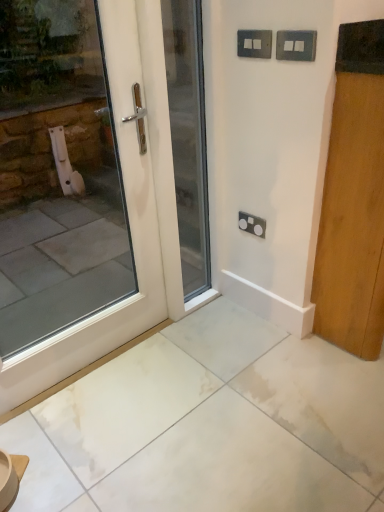
This screenshot has width=384, height=512. What do you see at coordinates (128, 216) in the screenshot? I see `white glossy door at left, which is counted as the first door, starting from the left` at bounding box center [128, 216].

What is the approximate width of satin black socket at center, positioned as the 3th electric outlet in top-to-bottom order?

It is 0.78 inches.

The image size is (384, 512). Describe the element at coordinates (296, 45) in the screenshot. I see `metallic gray switch at upper right, which is counted as the second electric outlet, starting from the bottom` at that location.

What is the approximate width of white glossy door at center, acting as the second door starting from the left?

white glossy door at center, acting as the second door starting from the left, is 3.87 inches in width.

Measure the distance between white glossy door at center, which is the 2th door from right to left, and camera.

white glossy door at center, which is the 2th door from right to left, and camera are 4.50 feet apart.

Where is `wooden door at right, the 3th door viewed from the left`? wooden door at right, the 3th door viewed from the left is located at coordinates (353, 220).

Are metallic silver switch at upper center, which ranks as the 3th electric outlet in bottom-to-top order, and satin black socket at center, arranged as the first electric outlet when ordered from the bottom, beside each other?

metallic silver switch at upper center, which ranks as the 3th electric outlet in bottom-to-top order, is not next to satin black socket at center, arranged as the first electric outlet when ordered from the bottom, and they're not touching.

Which object is wider, metallic silver switch at upper center, which ranks as the 3th electric outlet in bottom-to-top order, or satin black socket at center, acting as the first electric outlet starting from the back?

Wider between the two is metallic silver switch at upper center, which ranks as the 3th electric outlet in bottom-to-top order.

Which point is more forward, (245,44) or (238,219)?

The point (245,44) is closer.

How much distance is there between metallic silver switch at upper center, the second electric outlet viewed from the front, and satin black socket at center, arranged as the first electric outlet when ordered from the bottom?

metallic silver switch at upper center, the second electric outlet viewed from the front, is 64.26 centimeters from satin black socket at center, arranged as the first electric outlet when ordered from the bottom.

How different are the orientations of wooden door at right, the 3th door viewed from the left, and white glossy door at center, acting as the second door starting from the left, in degrees?

wooden door at right, the 3th door viewed from the left, and white glossy door at center, acting as the second door starting from the left, are facing 1.06 degrees away from each other.

Which of these two, wooden door at right, positioned as the 1th door in right-to-left order, or white glossy door at center, which is the 2th door from right to left, is bigger?

With larger size is wooden door at right, positioned as the 1th door in right-to-left order.

Is white glossy door at center, which is the 2th door from right to left, completely or partially inside wooden door at right, positioned as the 1th door in right-to-left order?

No, white glossy door at center, which is the 2th door from right to left, is located outside of wooden door at right, positioned as the 1th door in right-to-left order.

Looking at this image, is wooden door at right, the 3th door viewed from the left, closer to camera compared to white glossy door at center, acting as the second door starting from the left?

That is True.

Does white glossy door at center, which is the 2th door from right to left, appear on the right side of white glossy door at left, acting as the third door starting from the right?

Indeed, white glossy door at center, which is the 2th door from right to left, is positioned on the right side of white glossy door at left, acting as the third door starting from the right.

Is white glossy door at center, acting as the second door starting from the left, next to white glossy door at left, acting as the third door starting from the right, and touching it?

There is a gap between white glossy door at center, acting as the second door starting from the left, and white glossy door at left, acting as the third door starting from the right.

Do you think white glossy door at center, acting as the second door starting from the left, is within white glossy door at left, acting as the third door starting from the right, or outside of it?

white glossy door at center, acting as the second door starting from the left, is outside white glossy door at left, acting as the third door starting from the right.

Which object is closer to the camera, white glossy door at center, acting as the second door starting from the left, or white glossy door at left, acting as the third door starting from the right?

white glossy door at left, acting as the third door starting from the right, is closer to the camera.

Is the depth of white glossy door at left, acting as the third door starting from the right, greater than that of white glossy door at center, acting as the second door starting from the left?

No, white glossy door at left, acting as the third door starting from the right, is closer to the camera.

Which is correct: white glossy door at left, acting as the third door starting from the right, is inside white glossy door at center, which is the 2th door from right to left, or outside of it?

The correct answer is: outside.

Is white glossy door at left, acting as the third door starting from the right, facing towards white glossy door at center, which is the 2th door from right to left?

No, white glossy door at left, acting as the third door starting from the right, is not turned towards white glossy door at center, which is the 2th door from right to left.

Is white glossy door at left, acting as the third door starting from the right, far away from white glossy door at center, acting as the second door starting from the left?

white glossy door at left, acting as the third door starting from the right, is near white glossy door at center, acting as the second door starting from the left, not far away.

Identify the location of electric outlet that is the 1st one above the satin black socket at center, acting as the first electric outlet starting from the back (from a real-world perspective). (296, 45).

Looking at the image, does metallic gray switch at upper right, which is counted as the 2th electric outlet, starting from the top, seem bigger or smaller compared to satin black socket at center, acting as the first electric outlet starting from the back?

metallic gray switch at upper right, which is counted as the 2th electric outlet, starting from the top, is bigger than satin black socket at center, acting as the first electric outlet starting from the back.

Can you tell me how much metallic gray switch at upper right, the 3th electric outlet from the back, and satin black socket at center, acting as the first electric outlet starting from the back, differ in facing direction?

The angular difference between metallic gray switch at upper right, the 3th electric outlet from the back, and satin black socket at center, acting as the first electric outlet starting from the back, is 0.0235 degrees.

From the picture: Does metallic gray switch at upper right, the 3th electric outlet from the back, have a lesser height compared to satin black socket at center, which ranks as the third electric outlet in front-to-back order?

Correct, metallic gray switch at upper right, the 3th electric outlet from the back, is not as tall as satin black socket at center, which ranks as the third electric outlet in front-to-back order.

Which is more to the left, metallic gray switch at upper right, which is counted as the second electric outlet, starting from the bottom, or wooden door at right, positioned as the 1th door in right-to-left order?

From the viewer's perspective, metallic gray switch at upper right, which is counted as the second electric outlet, starting from the bottom, appears more on the left side.

Can wooden door at right, the 3th door viewed from the left, be found inside metallic gray switch at upper right, which is counted as the 2th electric outlet, starting from the top?

That's incorrect, wooden door at right, the 3th door viewed from the left, is not inside metallic gray switch at upper right, which is counted as the 2th electric outlet, starting from the top.

Is metallic gray switch at upper right, which is counted as the 2th electric outlet, starting from the top, oriented towards wooden door at right, positioned as the 1th door in right-to-left order?

No, metallic gray switch at upper right, which is counted as the 2th electric outlet, starting from the top, is not turned towards wooden door at right, positioned as the 1th door in right-to-left order.

In the scene shown: From the image's perspective, does metallic gray switch at upper right, acting as the 1th electric outlet starting from the front, appear higher than wooden door at right, the 3th door viewed from the left?

Yes, from the image's perspective, metallic gray switch at upper right, acting as the 1th electric outlet starting from the front, is above wooden door at right, the 3th door viewed from the left.

Does satin black socket at center, which ranks as the third electric outlet in front-to-back order, come in front of white glossy door at center, acting as the second door starting from the left?

That is False.

Which electric outlet is the 2nd one when counting from the right side of the white glossy door at center, which is the 2th door from right to left? Please provide its 2D coordinates.

[(251, 224)]

From the picture: Which of these two, satin black socket at center, which ranks as the third electric outlet in front-to-back order, or white glossy door at center, acting as the second door starting from the left, is smaller?

satin black socket at center, which ranks as the third electric outlet in front-to-back order.

From a real-world perspective, which object stands above the other?

white glossy door at center, which is the 2th door from right to left.

Starting from the metallic silver switch at upper center, which ranks as the 3th electric outlet in bottom-to-top order, which electric outlet is the 1st one to the right? Please provide its 2D coordinates.

[(251, 224)]

Find the location of a particular element. door that is the 1st object located below the white glossy door at center, acting as the second door starting from the left (from the image's perspective) is located at coordinates (353, 220).

Estimate the real-world distances between objects in this image. Which object is closer to wooden door at right, the 3th door viewed from the left, satin black socket at center, acting as the first electric outlet starting from the back, or white glossy door at left, which is counted as the first door, starting from the left?

satin black socket at center, acting as the first electric outlet starting from the back, lies closer to wooden door at right, the 3th door viewed from the left, than the other object.

Looking at the image, which one is located closer to white glossy door at left, which is counted as the first door, starting from the left, satin black socket at center, positioned as the 3th electric outlet in top-to-bottom order, or metallic silver switch at upper center, which ranks as the 3th electric outlet in bottom-to-top order?

Based on the image, satin black socket at center, positioned as the 3th electric outlet in top-to-bottom order, appears to be nearer to white glossy door at left, which is counted as the first door, starting from the left.

Estimate the real-world distances between objects in this image. Which object is further from metallic silver switch at upper center, which is counted as the first electric outlet, starting from the top, metallic gray switch at upper right, the 3th electric outlet from the back, or white glossy door at left, which is counted as the first door, starting from the left?

Based on the image, white glossy door at left, which is counted as the first door, starting from the left, appears to be further to metallic silver switch at upper center, which is counted as the first electric outlet, starting from the top.

Based on their spatial positions, is wooden door at right, the 3th door viewed from the left, or metallic gray switch at upper right, which is counted as the 2th electric outlet, starting from the top, closer to white glossy door at center, acting as the second door starting from the left?

The object closer to white glossy door at center, acting as the second door starting from the left, is metallic gray switch at upper right, which is counted as the 2th electric outlet, starting from the top.

Considering their positions, is white glossy door at left, which is counted as the first door, starting from the left, positioned closer to metallic silver switch at upper center, which is counted as the first electric outlet, starting from the top, than metallic gray switch at upper right, which is counted as the second electric outlet, starting from the bottom?

metallic gray switch at upper right, which is counted as the second electric outlet, starting from the bottom.

Estimate the real-world distances between objects in this image. Which object is further from white glossy door at left, acting as the third door starting from the right, satin black socket at center, arranged as the first electric outlet when ordered from the bottom, or white glossy door at center, acting as the second door starting from the left?

satin black socket at center, arranged as the first electric outlet when ordered from the bottom.

When comparing their distances from metallic gray switch at upper right, acting as the 1th electric outlet starting from the front, does wooden door at right, positioned as the 1th door in right-to-left order, or satin black socket at center, arranged as the first electric outlet when ordered from the bottom, seem further?

satin black socket at center, arranged as the first electric outlet when ordered from the bottom, is positioned further to the anchor metallic gray switch at upper right, acting as the 1th electric outlet starting from the front.

Based on their spatial positions, is satin black socket at center, acting as the first electric outlet starting from the back, or white glossy door at center, which is the 2th door from right to left, further from metallic silver switch at upper center, the 2th electric outlet viewed from the back?

satin black socket at center, acting as the first electric outlet starting from the back, lies further to metallic silver switch at upper center, the 2th electric outlet viewed from the back, than the other object.

I want to click on door between white glossy door at left, which is counted as the first door, starting from the left, and metallic gray switch at upper right, which is counted as the 2th electric outlet, starting from the top, in the horizontal direction, so click(188, 138).

Find the location of `electric outlet that lies between metallic silver switch at upper center, which ranks as the 3th electric outlet in bottom-to-top order, and white glossy door at center, which is the 2th door from right to left, from top to bottom`. electric outlet that lies between metallic silver switch at upper center, which ranks as the 3th electric outlet in bottom-to-top order, and white glossy door at center, which is the 2th door from right to left, from top to bottom is located at coordinates (296, 45).

In order to click on electric outlet between metallic silver switch at upper center, which ranks as the 3th electric outlet in bottom-to-top order, and satin black socket at center, arranged as the first electric outlet when ordered from the bottom, vertically in this screenshot , I will do `click(296, 45)`.

Locate an element on the screen. The height and width of the screenshot is (512, 384). door between white glossy door at left, acting as the third door starting from the right, and metallic silver switch at upper center, the second electric outlet viewed from the front is located at coordinates coord(188,138).